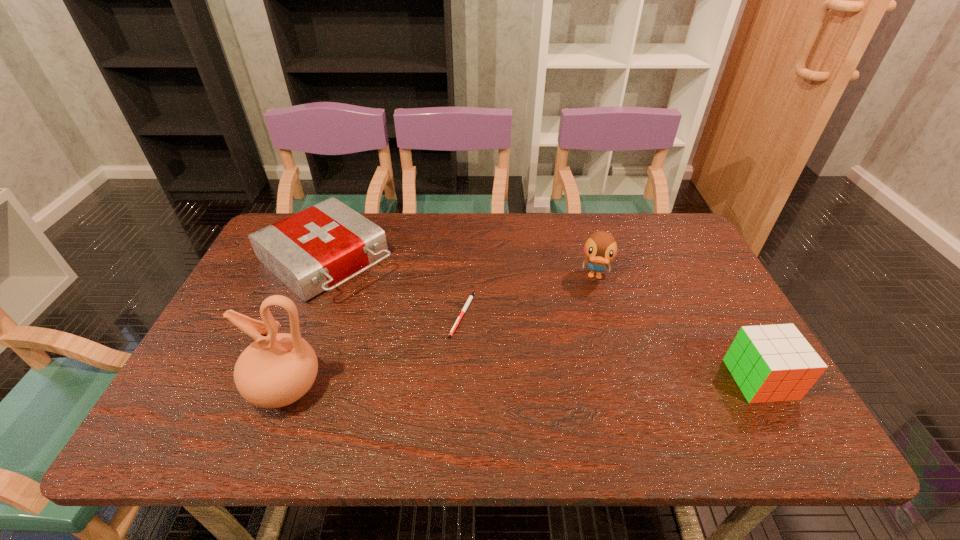
The image size is (960, 540). In order to click on blank space at the left edge of the desktop in this screenshot , I will do `click(219, 345)`.

The height and width of the screenshot is (540, 960). Find the location of `vacant area at the near left corner of the desktop`. vacant area at the near left corner of the desktop is located at coordinates (221, 396).

In the image, there is a desktop. At what (x,y) coordinates should I click in order to perform the action: click on blank space at the far right corner. Please return your answer as a coordinate pair (x, y). This screenshot has width=960, height=540. Looking at the image, I should click on (667, 251).

In the image, there is a desktop. Where is `vacant space at the near right corner`? This screenshot has height=540, width=960. vacant space at the near right corner is located at coordinates (762, 407).

Locate an element on the screen. This screenshot has width=960, height=540. unoccupied area between the cube and the first-aid kit is located at coordinates (543, 320).

The image size is (960, 540). What are the coordinates of `vacant area that lies between the rightmost object and the shortest object` in the screenshot? It's located at (612, 347).

Find the location of `vacant space that's between the third object from left to right and the tallest object`. vacant space that's between the third object from left to right and the tallest object is located at coordinates (374, 351).

You are a GUI agent. You are given a task and a screenshot of the screen. Output one action in this format:
    pyautogui.click(x=<x>, y=<y>)
    Task: Click on the unoccupied position between the fourth shortest object and the third object from right to left
    This screenshot has height=540, width=960.
    Given the screenshot: What is the action you would take?
    pyautogui.click(x=529, y=295)

Where is `free space between the pottery and the rightmost object`? This screenshot has height=540, width=960. free space between the pottery and the rightmost object is located at coordinates click(523, 384).

This screenshot has height=540, width=960. Identify the location of vacant area between the duck and the second shortest object. (461, 268).